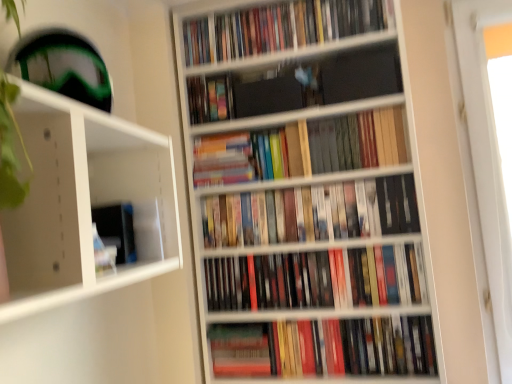
Question: From a real-world perspective, is multicolored hardcover books at center, the second book when ordered from top to bottom, above or below hardcover books at center, the 2th book positioned from the bottom?

Choices:
 (A) above
 (B) below

Answer: (A)

Question: Do you think multicolored hardcover books at center, the second book when ordered from top to bottom, is within hardcover books at center, the 2th book positioned from the bottom, or outside of it?

Choices:
 (A) outside
 (B) inside

Answer: (A)

Question: Which of these objects is positioned closest to the wooden bookshelf at center?

Choices:
 (A) multicolored hardcover books at center, arranged as the 6th book when ordered from the bottom
 (B) hardcover books at center, marked as the 6th book in a top-to-bottom arrangement
 (C) hardcover books at center, the 3th book positioned from the top
 (D) hardcover books at upper center, positioned as the first book in top-to-bottom order
 (E) hardcover book at center

Answer: (C)

Question: Considering the real-world distances, which object is farthest from the wooden bookshelf at center?

Choices:
 (A) hardcover book at center, which appears as the 1th book when ordered from the bottom
 (B) hardcover book at center
 (C) multicolored hardcover books at center, the second book when ordered from top to bottom
 (D) hardcover books at upper center, positioned as the first book in top-to-bottom order
 (E) hardcover books at center, positioned as the fourth book in bottom-to-top order

Answer: (B)